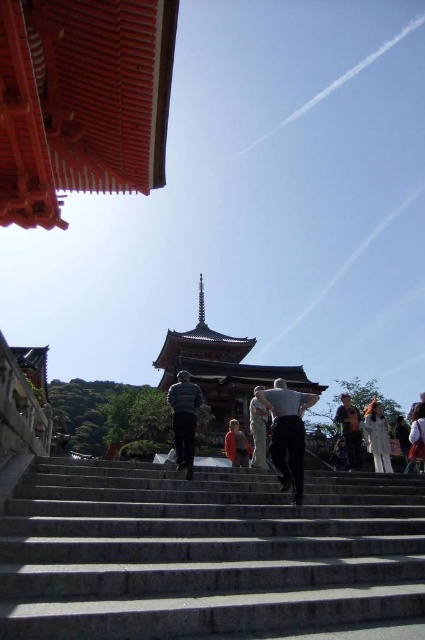
Based on the photo, you are a photographer standing at the bottom of the stone steps. You want to capture a photo of the light gray fabric pants at center and the white cotton dress at lower right. Which of these two items of clothing has a greater width in the image?

The light gray fabric pants at center has a greater width than the white cotton dress at lower right.

You are standing at the bottom of the gray stone stairs at center and looking up. There is a person wearing light gray fabric pants at center. In which direction should you walk to reach the person?

The gray stone stairs at center is to the left of the light gray fabric pants at center, so you should walk to the right to reach the person.

You are standing on the gray stone stairs at center and want to greet the person wearing the orange cotton shirt at center. In which direction should you move to approach them?

The gray stone stairs at center is to the right of the orange cotton shirt at center, so you should move to your left to approach them.